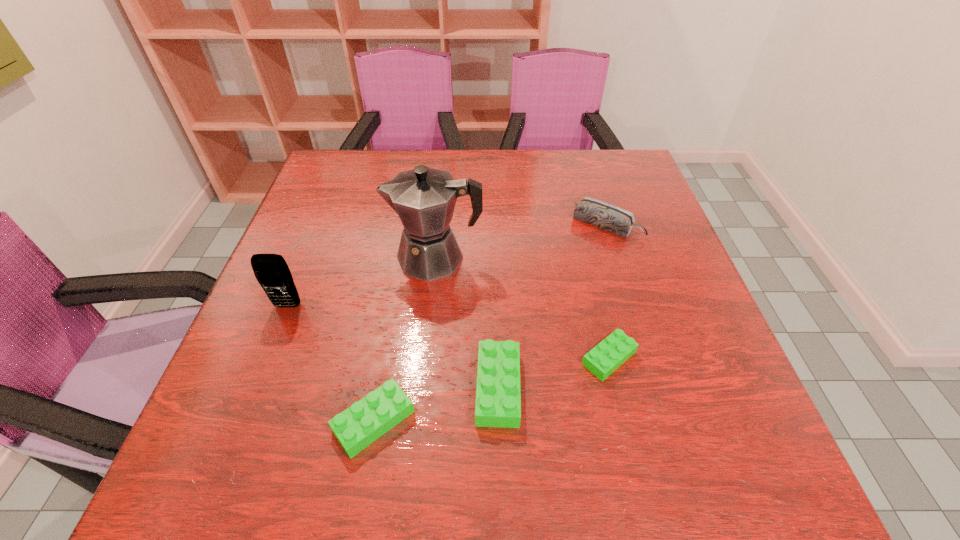
The image size is (960, 540). In order to click on vacant space located 0.260m on the left of the tallest Lego in this screenshot , I will do `click(331, 388)`.

At what (x,y) coordinates should I click in order to perform the action: click on vacant space positioned on the left of the shortest Lego. Please return your answer as a coordinate pair (x, y). Looking at the image, I should click on (539, 358).

Find the location of a particular element. This screenshot has width=960, height=540. blank space located on the screen of the fourth nearest object is located at coordinates (263, 369).

Locate an element on the screen. The height and width of the screenshot is (540, 960). blank space located at the spout of the coffeepot is located at coordinates 368,258.

Where is `free space located 0.130m at the spout of the coffeepot`? The width and height of the screenshot is (960, 540). free space located 0.130m at the spout of the coffeepot is located at coordinates (333, 258).

The width and height of the screenshot is (960, 540). What are the coordinates of `free region located at the spout of the coffeepot` in the screenshot? It's located at (333, 258).

At what (x,y) coordinates should I click in order to perform the action: click on vacant space situated 0.290m on the front of the pencil box. Please return your answer as a coordinate pair (x, y). Looking at the image, I should click on (642, 338).

Locate an element on the screen. The height and width of the screenshot is (540, 960). object that is at the left edge is located at coordinates (271, 270).

The height and width of the screenshot is (540, 960). I want to click on object situated at the right edge, so click(611, 218).

At what (x,y) coordinates should I click in order to perform the action: click on free point at the far edge. Please return your answer as a coordinate pair (x, y). The height and width of the screenshot is (540, 960). Looking at the image, I should click on (384, 152).